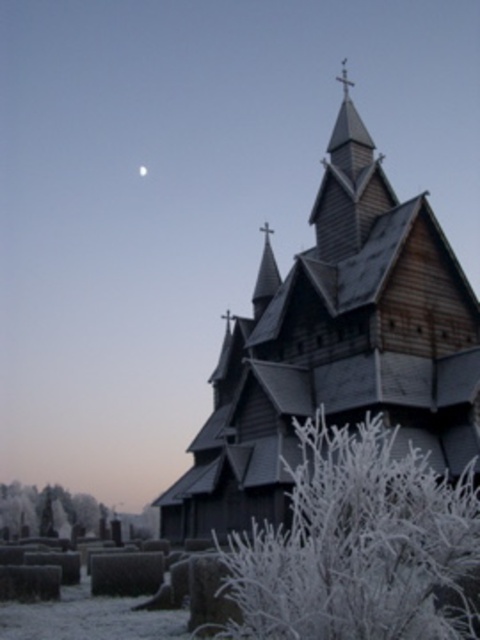
Question: Which point is farther to the camera?

Choices:
 (A) frosted white branches at center
 (B) wooden church at center

Answer: (B)

Question: Considering the relative positions of wooden church at center and frosted white branches at center in the image provided, where is wooden church at center located with respect to frosted white branches at center?

Choices:
 (A) right
 (B) left

Answer: (B)

Question: Among these points, which one is nearest to the camera?

Choices:
 (A) (284, 332)
 (B) (425, 636)

Answer: (B)

Question: Is wooden church at center to the left of frosted white branches at center from the viewer's perspective?

Choices:
 (A) no
 (B) yes

Answer: (B)

Question: Can you confirm if wooden church at center is positioned below frosted white branches at center?

Choices:
 (A) no
 (B) yes

Answer: (A)

Question: Which point is closer to the camera taking this photo?

Choices:
 (A) (364, 170)
 (B) (269, 586)

Answer: (B)